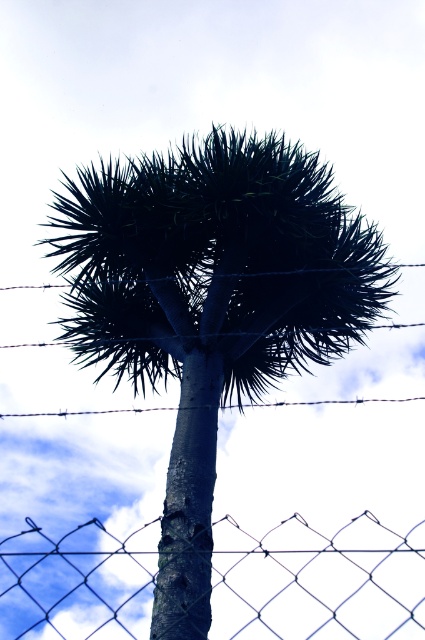
Question: Which object appears closest to the camera in this image?

Choices:
 (A) dark green textured palm tree at center
 (B) barbed wire at center

Answer: (A)

Question: Considering the relative positions of dark green textured palm tree at center and barbed wire at center in the image provided, where is dark green textured palm tree at center located with respect to barbed wire at center?

Choices:
 (A) above
 (B) below

Answer: (A)

Question: Which point is farther to the camera?

Choices:
 (A) barbed wire at center
 (B) wire mesh fence at center

Answer: (A)

Question: Which object is positioned farthest from the barbed wire at center?

Choices:
 (A) wire mesh fence at center
 (B) dark green textured palm tree at center

Answer: (B)

Question: Is dark green textured palm tree at center to the right of barbed wire at center from the viewer's perspective?

Choices:
 (A) no
 (B) yes

Answer: (A)

Question: Can you confirm if dark green textured palm tree at center is positioned above wire mesh fence at center?

Choices:
 (A) yes
 (B) no

Answer: (A)